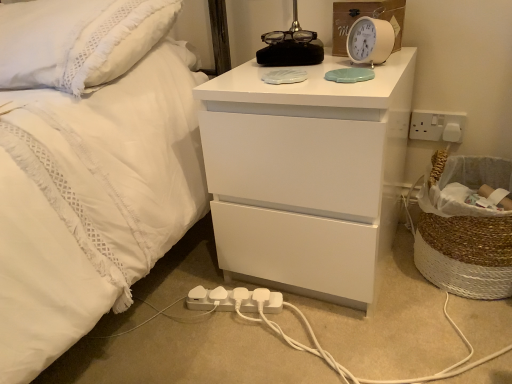
Identify the location of vacant area that lies in front of white glossy chest of drawers at upper center. (349, 343).